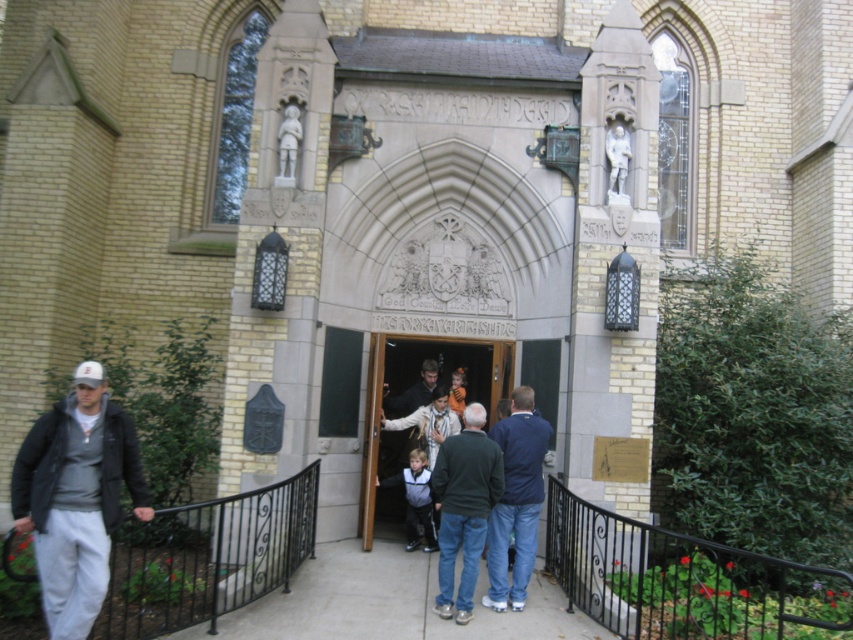
You are a visitor at the church entrance and want to take a photo of both the blue denim jeans at center and the dark blue jacket at center. Which object should you focus on first to ensure both are in frame?

You should focus on the blue denim jeans at center first since it is taller than the dark blue jacket at center, ensuring both fit within the camera frame.

You are standing at the entrance of the church and want to determine the relative positions of two points marked on the facade. Which point is nearer to you, point (97, 429) or point (532, 499)?

Point (97, 429) is closer to the viewer than point (532, 499).

You are standing at the entrance of the church and see the blue denim jeans at center and the dark blue jacket at center. Which one is positioned to the right of the other?

The blue denim jeans at center is to the right of the dark blue jacket at center according to the description.